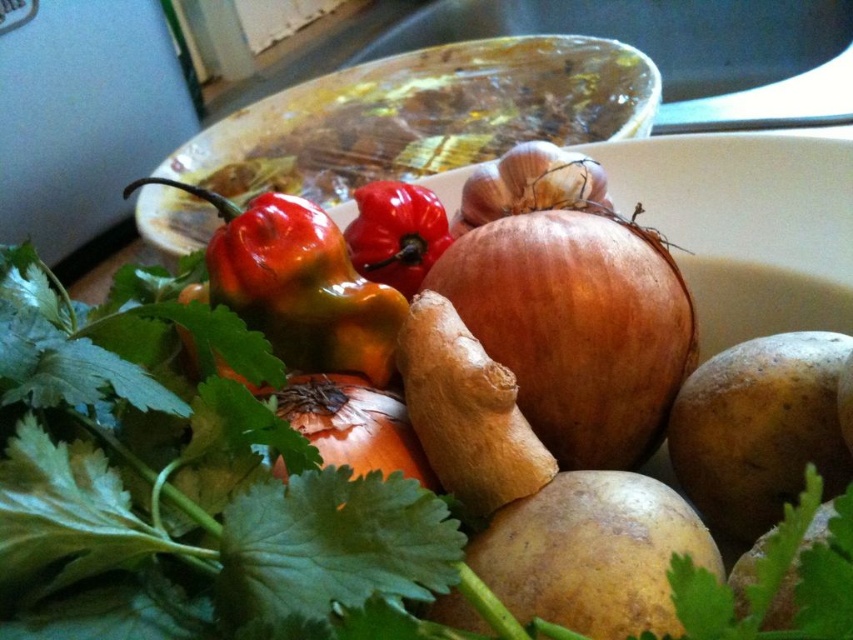
You are a chef preparing a dish and need to reach the brown matte potato at lower right from your current position. The potato is 53.18 centimeters away from you. If your arm can extend 60 centimeters, can you comfortably reach it without moving your body?

The brown matte potato at lower right is 53.18 centimeters away from the camera, which represents your position. Since your arm can extend 60 centimeters, you can comfortably reach it without moving your body.

You are a chef preparing a meal and need to choose between the brown matte potato at center and the brown matte potato at lower right. Which potato should you pick if you want the larger one?

The brown matte potato at lower right is larger than the brown matte potato at center, so you should pick the brown matte potato at lower right.